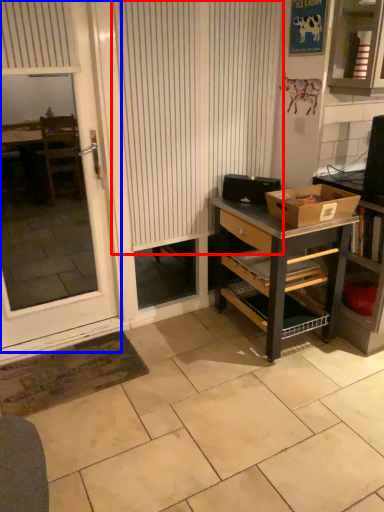
Question: Which point is further to the camera, curtain (highlighted by a red box) or screen door (highlighted by a blue box)?

Choices:
 (A) curtain
 (B) screen door

Answer: (A)